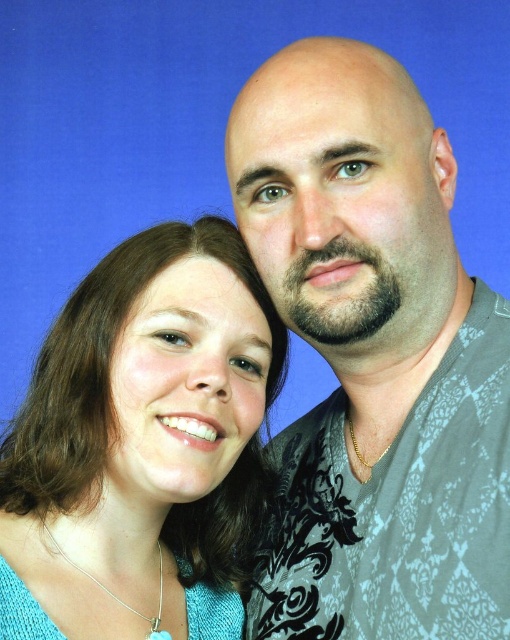
Question: Among these points, which one is farthest from the camera?

Choices:
 (A) (404, 10)
 (B) (475, 397)

Answer: (A)

Question: Does gray printed shirt at upper right appear over matte teal sweater at center?

Choices:
 (A) yes
 (B) no

Answer: (A)

Question: Which object appears farthest from the camera in this image?

Choices:
 (A) blue matte backdrop at upper center
 (B) matte teal sweater at center
 (C) gray printed shirt at upper right

Answer: (A)

Question: Can you confirm if gray printed shirt at upper right is thinner than matte teal sweater at center?

Choices:
 (A) no
 (B) yes

Answer: (B)

Question: Is gray printed shirt at upper right thinner than blue matte backdrop at upper center?

Choices:
 (A) no
 (B) yes

Answer: (B)

Question: Which object is positioned closest to the blue matte backdrop at upper center?

Choices:
 (A) matte teal sweater at center
 (B) gray printed shirt at upper right

Answer: (B)